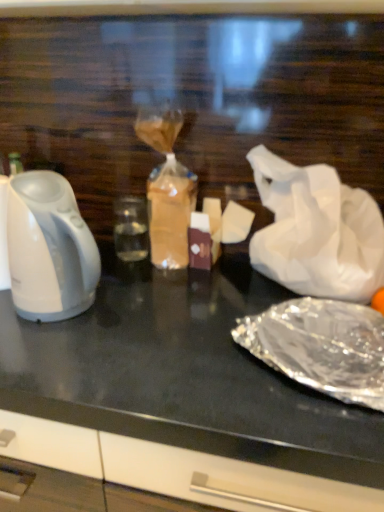
Where is `blank area to the left of white crumpled paper at right`? This screenshot has height=512, width=384. blank area to the left of white crumpled paper at right is located at coordinates (193, 297).